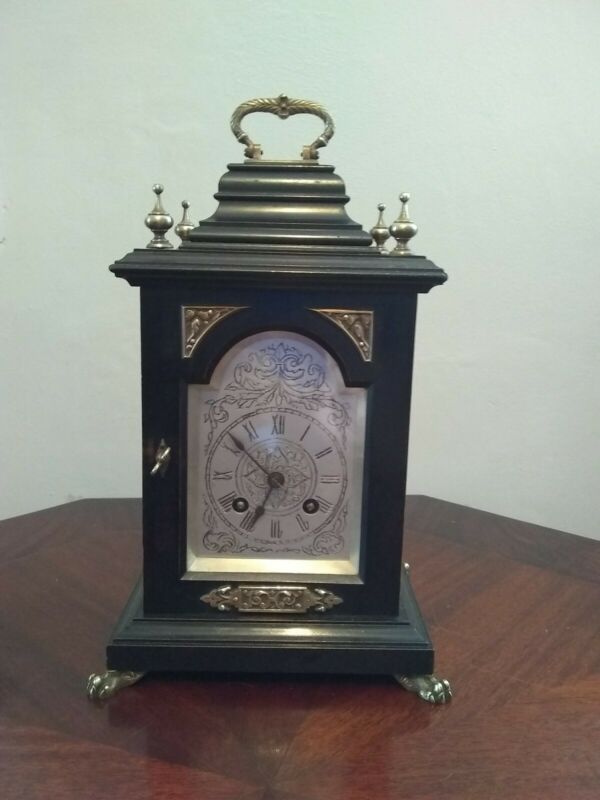
Image resolution: width=600 pixels, height=800 pixels. Identify the location of handle. (283, 105).